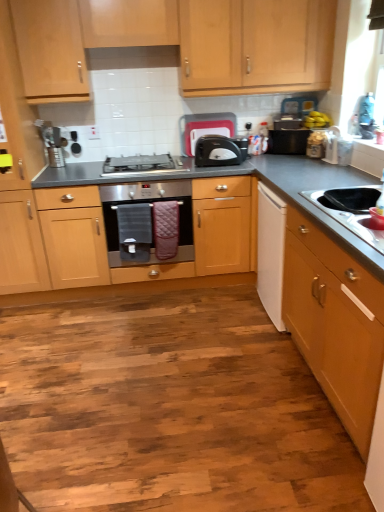
Where is `free space to the right of satin black toaster at center`? This screenshot has height=512, width=384. free space to the right of satin black toaster at center is located at coordinates (271, 158).